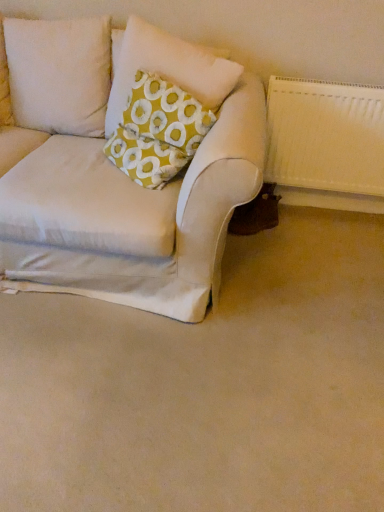
Find the location of a particular element. This screenshot has width=384, height=512. yellow fabric pillow at upper left is located at coordinates (168, 68).

Describe the element at coordinates (325, 137) in the screenshot. I see `white textured radiator at right` at that location.

Image resolution: width=384 pixels, height=512 pixels. What are the coordinates of `yellow fabric pillow at upper left` in the screenshot? It's located at (168, 68).

Which is less distant, (279, 177) or (154, 68)?

The point (154, 68) is in front.

Is white textured radiator at right taller or shorter than yellow fabric pillow at upper left?

Considering their sizes, white textured radiator at right has more height than yellow fabric pillow at upper left.

From a real-world perspective, is white textured radiator at right positioned over yellow fabric pillow at upper left based on gravity?

Incorrect, from a real-world perspective, white textured radiator at right is lower than yellow fabric pillow at upper left.

Is yellow fabric pillow at upper left at the left side of white textured radiator at right?

Correct, you'll find yellow fabric pillow at upper left to the left of white textured radiator at right.

From the picture: Would you say yellow fabric pillow at upper left contains white textured radiator at right?

Actually, white textured radiator at right is outside yellow fabric pillow at upper left.

Is yellow fabric pillow at upper left not near white textured radiator at right?

No.

Between yellow fabric pillow at upper left and white textured radiator at right, which one has smaller size?

white textured radiator at right is smaller.

From a real-world perspective, between yellow fabric pillow at upper left and beige fabric couch at lower left, who is vertically higher?

In real-world perspective, yellow fabric pillow at upper left is above.

From the image's perspective, is yellow fabric pillow at upper left under beige fabric couch at lower left?

No, from the image's perspective, yellow fabric pillow at upper left is not below beige fabric couch at lower left.

Is yellow fabric pillow at upper left facing towards beige fabric couch at lower left?

No, yellow fabric pillow at upper left does not turn towards beige fabric couch at lower left.

Between yellow fabric pillow at upper left and beige fabric couch at lower left, which one has less height?

beige fabric couch at lower left is shorter.

From a real-world perspective, which object rests below the other?

beige fabric couch at lower left.

Considering the sizes of objects white textured radiator at right and beige fabric couch at lower left in the image provided, who is taller, white textured radiator at right or beige fabric couch at lower left?

white textured radiator at right is taller.

From the image's perspective, between white textured radiator at right and beige fabric couch at lower left, which one is located above?

From the image's view, white textured radiator at right is above.

Considering the positions of objects white textured radiator at right and beige fabric couch at lower left in the image provided, who is in front, white textured radiator at right or beige fabric couch at lower left?

Positioned in front is beige fabric couch at lower left.

Is beige fabric couch at lower left thinner than yellow fabric pillow at upper left?

Incorrect, the width of beige fabric couch at lower left is not less than that of yellow fabric pillow at upper left.

Are beige fabric couch at lower left and yellow fabric pillow at upper left far apart?

No, there isn't a large distance between beige fabric couch at lower left and yellow fabric pillow at upper left.

From the image's perspective, relative to yellow fabric pillow at upper left, is beige fabric couch at lower left above or below?

Based on their image positions, beige fabric couch at lower left is located beneath yellow fabric pillow at upper left.

From the image's perspective, is beige fabric couch at lower left above or below white textured radiator at right?

Based on their image positions, beige fabric couch at lower left is located beneath white textured radiator at right.

Considering the positions of objects beige fabric couch at lower left and white textured radiator at right in the image provided, who is more to the left, beige fabric couch at lower left or white textured radiator at right?

From the viewer's perspective, beige fabric couch at lower left appears more on the left side.

Considering the points (339, 253) and (290, 115), which point is in front, point (339, 253) or point (290, 115)?

The point (290, 115) is closer to the camera.

Which of these two, beige fabric couch at lower left or white textured radiator at right, is smaller?

white textured radiator at right is smaller.

The height and width of the screenshot is (512, 384). What are the coordinates of `radiator lying behind the yellow fabric pillow at upper left` in the screenshot? It's located at (325, 137).

Locate an element on the screen. pillow on the left of white textured radiator at right is located at coordinates (168, 68).

Based on their spatial positions, is white textured radiator at right or yellow fabric pillow at upper left further from beige fabric couch at lower left?

yellow fabric pillow at upper left is positioned further to the anchor beige fabric couch at lower left.

Based on their spatial positions, is yellow fabric pillow at upper left or beige fabric couch at lower left further from white textured radiator at right?

beige fabric couch at lower left lies further to white textured radiator at right than the other object.

Based on their spatial positions, is yellow fabric pillow at upper left or white textured radiator at right closer to beige fabric couch at lower left?

white textured radiator at right is positioned closer to the anchor beige fabric couch at lower left.

Which object lies further to the anchor point yellow fabric pillow at upper left, white textured radiator at right or beige fabric couch at lower left?

Among the two, beige fabric couch at lower left is located further to yellow fabric pillow at upper left.

Looking at the image, which one is located further to yellow fabric pillow at upper left, beige fabric couch at lower left or white textured radiator at right?

Based on the image, beige fabric couch at lower left appears to be further to yellow fabric pillow at upper left.

Based on their spatial positions, is beige fabric couch at lower left or yellow fabric pillow at upper left further from white textured radiator at right?

beige fabric couch at lower left is further to white textured radiator at right.

Identify the location of pillow between beige fabric couch at lower left and white textured radiator at right from left to right. (168, 68).